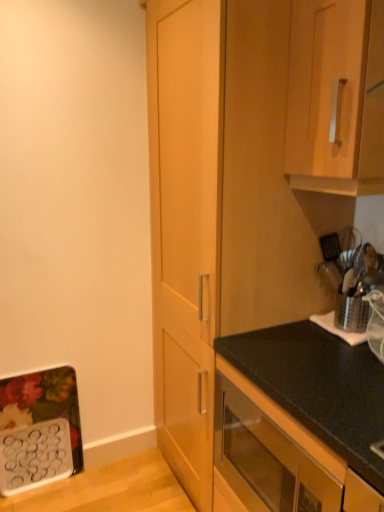
The height and width of the screenshot is (512, 384). What do you see at coordinates (276, 457) in the screenshot?
I see `black matte oven at lower center, which is counted as the 3th cabinetry, starting from the top` at bounding box center [276, 457].

This screenshot has height=512, width=384. What do you see at coordinates (351, 276) in the screenshot? I see `silver metallic utensil holder at right` at bounding box center [351, 276].

What do you see at coordinates (248, 264) in the screenshot?
I see `wooden cabinet at center, the second cabinetry viewed from the top` at bounding box center [248, 264].

At what (x,y) coordinates should I click in order to perform the action: click on black matte oven at lower center, which is counted as the 3th cabinetry, starting from the top. Please return your answer as a coordinate pair (x, y). This screenshot has height=512, width=384. Looking at the image, I should click on (276, 457).

Does point (337, 59) come farther from viewer compared to point (270, 307)?

No, it is not.

Based on the photo, considering the sizes of wooden cabinet handle at upper right, which appears as the 1th cabinetry when viewed from the top, and wooden cabinet at center, acting as the second cabinetry starting from the bottom, in the image, is wooden cabinet handle at upper right, which appears as the 1th cabinetry when viewed from the top, taller or shorter than wooden cabinet at center, acting as the second cabinetry starting from the bottom,?

Clearly, wooden cabinet handle at upper right, which appears as the 1th cabinetry when viewed from the top, is shorter compared to wooden cabinet at center, acting as the second cabinetry starting from the bottom.

Is wooden cabinet handle at upper right, the third cabinetry when ordered from bottom to top, far away from wooden cabinet at center, acting as the second cabinetry starting from the bottom?

wooden cabinet handle at upper right, the third cabinetry when ordered from bottom to top, is near wooden cabinet at center, acting as the second cabinetry starting from the bottom, not far away.

What are the coordinates of `the 1st cabinetry directly beneath the wooden cabinet handle at upper right, the third cabinetry when ordered from bottom to top (from a real-world perspective)` in the screenshot? It's located at (248, 264).

In terms of width, does black matte oven at lower center, which is counted as the 3th cabinetry, starting from the top, look wider or thinner when compared to wooden cabinet at center, acting as the second cabinetry starting from the bottom?

Considering their sizes, black matte oven at lower center, which is counted as the 3th cabinetry, starting from the top, looks slimmer than wooden cabinet at center, acting as the second cabinetry starting from the bottom.

Does black matte oven at lower center, which is counted as the 3th cabinetry, starting from the top, touch wooden cabinet at center, acting as the second cabinetry starting from the bottom?

No, black matte oven at lower center, which is counted as the 3th cabinetry, starting from the top, is not with wooden cabinet at center, acting as the second cabinetry starting from the bottom.

Which is further, (251,507) or (229,376)?

The point (229,376) is more distant.

Identify the location of cabinetry that is the 1st one when counting rightward from the wooden cabinet at center, the second cabinetry viewed from the top. This screenshot has width=384, height=512. (276, 457).

Is black matte oven at lower center, the first cabinetry ordered from the bottom, smaller than silver metallic utensil holder at right?

Actually, black matte oven at lower center, the first cabinetry ordered from the bottom, might be larger than silver metallic utensil holder at right.

Looking at their sizes, would you say black matte oven at lower center, the first cabinetry ordered from the bottom, is wider or thinner than silver metallic utensil holder at right?

black matte oven at lower center, the first cabinetry ordered from the bottom, is wider than silver metallic utensil holder at right.

From a real-world perspective, which object rests below the other?

silver metallic utensil holder at right.

Considering the sizes of objects silver metallic utensil holder at right and wooden cabinet at center, the second cabinetry viewed from the top, in the image provided, who is bigger, silver metallic utensil holder at right or wooden cabinet at center, the second cabinetry viewed from the top,?

With larger size is wooden cabinet at center, the second cabinetry viewed from the top.

Considering the sizes of objects silver metallic utensil holder at right and wooden cabinet at center, the second cabinetry viewed from the top, in the image provided, who is taller, silver metallic utensil holder at right or wooden cabinet at center, the second cabinetry viewed from the top,?

wooden cabinet at center, the second cabinetry viewed from the top, is taller.

I want to click on cabinetry that is the 3rd one when counting leftward from the silver metallic utensil holder at right, so click(248, 264).

Is wooden cabinet handle at upper right, the third cabinetry when ordered from bottom to top, facing away from black matte oven at lower center, which is counted as the 3th cabinetry, starting from the top?

wooden cabinet handle at upper right, the third cabinetry when ordered from bottom to top, is not turned away from black matte oven at lower center, which is counted as the 3th cabinetry, starting from the top.

Can black matte oven at lower center, the first cabinetry ordered from the bottom, be found inside wooden cabinet handle at upper right, which appears as the 1th cabinetry when viewed from the top?

Definitely not — black matte oven at lower center, the first cabinetry ordered from the bottom, is not inside wooden cabinet handle at upper right, which appears as the 1th cabinetry when viewed from the top.

Is wooden cabinet handle at upper right, which appears as the 1th cabinetry when viewed from the top, further to the viewer compared to black matte oven at lower center, the first cabinetry ordered from the bottom?

That is True.

Is point (307, 55) positioned behind point (233, 456)?

No, it is not.

Could you measure the distance between wooden cabinet at center, acting as the second cabinetry starting from the bottom, and silver metallic utensil holder at right?

A distance of 14.50 inches exists between wooden cabinet at center, acting as the second cabinetry starting from the bottom, and silver metallic utensil holder at right.

Can you tell me how much wooden cabinet at center, the second cabinetry viewed from the top, and silver metallic utensil holder at right differ in facing direction?

The angular difference between wooden cabinet at center, the second cabinetry viewed from the top, and silver metallic utensil holder at right is 0.634 degrees.

Is wooden cabinet at center, acting as the second cabinetry starting from the bottom, with silver metallic utensil holder at right?

No.

From the picture: Is wooden cabinet at center, the second cabinetry viewed from the top, positioned behind silver metallic utensil holder at right?

No, it is not.

How many degrees apart are the facing directions of silver metallic utensil holder at right and wooden cabinet handle at upper right, which appears as the 1th cabinetry when viewed from the top?

There is a 1.26-degree angle between the facing directions of silver metallic utensil holder at right and wooden cabinet handle at upper right, which appears as the 1th cabinetry when viewed from the top.

From the image's perspective, is silver metallic utensil holder at right located above or below wooden cabinet handle at upper right, the third cabinetry when ordered from bottom to top?

Clearly, from the image's perspective, silver metallic utensil holder at right is below wooden cabinet handle at upper right, the third cabinetry when ordered from bottom to top.

Based on the photo, is silver metallic utensil holder at right aimed at wooden cabinet handle at upper right, the third cabinetry when ordered from bottom to top?

No, silver metallic utensil holder at right does not turn towards wooden cabinet handle at upper right, the third cabinetry when ordered from bottom to top.

Is silver metallic utensil holder at right bigger than wooden cabinet handle at upper right, which appears as the 1th cabinetry when viewed from the top?

Incorrect, silver metallic utensil holder at right is not larger than wooden cabinet handle at upper right, which appears as the 1th cabinetry when viewed from the top.

Locate an element on the screen. The width and height of the screenshot is (384, 512). cabinetry above the wooden cabinet at center, acting as the second cabinetry starting from the bottom (from the image's perspective) is located at coordinates (336, 97).

You are a GUI agent. You are given a task and a screenshot of the screen. Output one action in this format:
    pyautogui.click(x=<x>, y=<y>)
    Task: Click on the cabinetry on the left of black matte oven at lower center, which is counted as the 3th cabinetry, starting from the top
    The image size is (384, 512).
    Given the screenshot: What is the action you would take?
    pyautogui.click(x=248, y=264)

Estimate the real-world distances between objects in this image. Which object is further from wooden cabinet at center, acting as the second cabinetry starting from the bottom, wooden cabinet handle at upper right, which appears as the 1th cabinetry when viewed from the top, or black matte oven at lower center, which is counted as the 3th cabinetry, starting from the top?

black matte oven at lower center, which is counted as the 3th cabinetry, starting from the top, is further to wooden cabinet at center, acting as the second cabinetry starting from the bottom.

Looking at the image, which one is located further to wooden cabinet at center, the second cabinetry viewed from the top, wooden cabinet handle at upper right, the third cabinetry when ordered from bottom to top, or silver metallic utensil holder at right?

The object further to wooden cabinet at center, the second cabinetry viewed from the top, is silver metallic utensil holder at right.

Looking at the image, which one is located closer to black matte oven at lower center, which is counted as the 3th cabinetry, starting from the top, silver metallic utensil holder at right or wooden cabinet at center, acting as the second cabinetry starting from the bottom?

Among the two, wooden cabinet at center, acting as the second cabinetry starting from the bottom, is located nearer to black matte oven at lower center, which is counted as the 3th cabinetry, starting from the top.

Considering their positions, is black matte oven at lower center, which is counted as the 3th cabinetry, starting from the top, positioned further to wooden cabinet at center, the second cabinetry viewed from the top, than silver metallic utensil holder at right?

The object further to wooden cabinet at center, the second cabinetry viewed from the top, is silver metallic utensil holder at right.

Which object lies nearer to the anchor point wooden cabinet at center, acting as the second cabinetry starting from the bottom, silver metallic utensil holder at right or black matte oven at lower center, the first cabinetry ordered from the bottom?

The object closer to wooden cabinet at center, acting as the second cabinetry starting from the bottom, is black matte oven at lower center, the first cabinetry ordered from the bottom.

Considering their positions, is wooden cabinet at center, the second cabinetry viewed from the top, positioned further to black matte oven at lower center, the first cabinetry ordered from the bottom, than wooden cabinet handle at upper right, which appears as the 1th cabinetry when viewed from the top?

wooden cabinet handle at upper right, which appears as the 1th cabinetry when viewed from the top, is further to black matte oven at lower center, the first cabinetry ordered from the bottom.

From the image, which object appears to be farther from silver metallic utensil holder at right, wooden cabinet handle at upper right, which appears as the 1th cabinetry when viewed from the top, or black matte oven at lower center, the first cabinetry ordered from the bottom?

black matte oven at lower center, the first cabinetry ordered from the bottom, lies further to silver metallic utensil holder at right than the other object.

Based on their spatial positions, is wooden cabinet handle at upper right, the third cabinetry when ordered from bottom to top, or wooden cabinet at center, acting as the second cabinetry starting from the bottom, closer to silver metallic utensil holder at right?

wooden cabinet at center, acting as the second cabinetry starting from the bottom.

The image size is (384, 512). I want to click on appliance between wooden cabinet handle at upper right, the third cabinetry when ordered from bottom to top, and black matte oven at lower center, the first cabinetry ordered from the bottom, from top to bottom, so click(x=351, y=276).

You are a GUI agent. You are given a task and a screenshot of the screen. Output one action in this format:
    pyautogui.click(x=<x>, y=<y>)
    Task: Click on the cabinetry that lies between wooden cabinet handle at upper right, which appears as the 1th cabinetry when viewed from the top, and silver metallic utensil holder at right from top to bottom
    Image resolution: width=384 pixels, height=512 pixels.
    Given the screenshot: What is the action you would take?
    pyautogui.click(x=248, y=264)

Where is `cabinetry between wooden cabinet handle at upper right, the third cabinetry when ordered from bottom to top, and black matte oven at lower center, the first cabinetry ordered from the bottom, in the vertical direction`? This screenshot has height=512, width=384. cabinetry between wooden cabinet handle at upper right, the third cabinetry when ordered from bottom to top, and black matte oven at lower center, the first cabinetry ordered from the bottom, in the vertical direction is located at coordinates (248, 264).

Where is `appliance between wooden cabinet at center, the second cabinetry viewed from the top, and black matte oven at lower center, the first cabinetry ordered from the bottom, from top to bottom`? appliance between wooden cabinet at center, the second cabinetry viewed from the top, and black matte oven at lower center, the first cabinetry ordered from the bottom, from top to bottom is located at coordinates (351, 276).